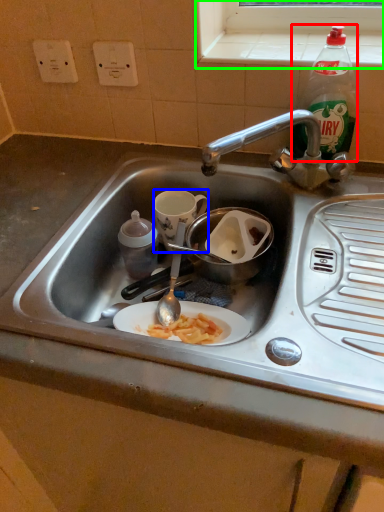
Question: Based on their relative distances, which object is nearer to bottle (highlighted by a red box)? Choose from coffee cup (highlighted by a blue box) and window sill (highlighted by a green box).

Choices:
 (A) coffee cup
 (B) window sill

Answer: (B)